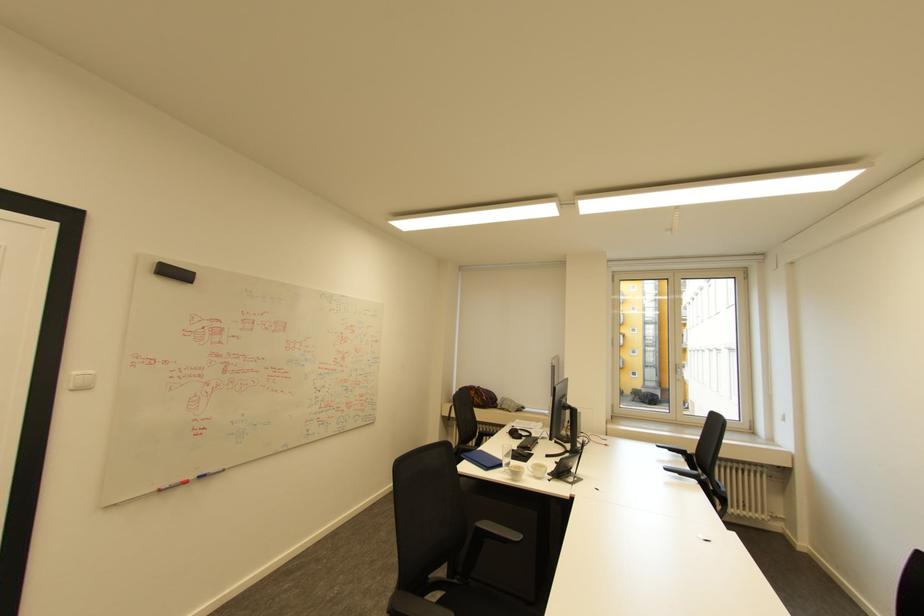
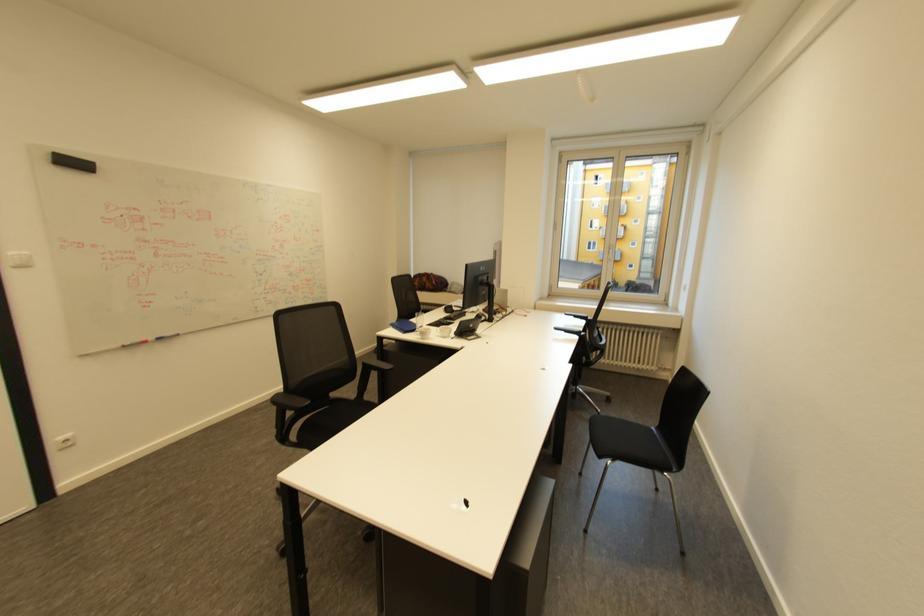
The point at (684, 474) is marked in the first image. Where is the corresponding point in the second image?

(570, 333)